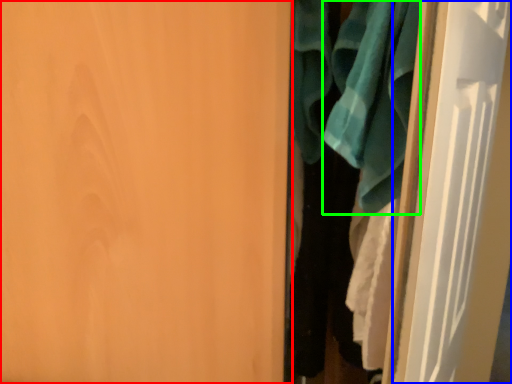
Question: Based on their relative distances, which object is farther from door (highlighted by a red box)? Choose from door (highlighted by a blue box) and bath towel (highlighted by a green box).

Choices:
 (A) door
 (B) bath towel

Answer: (A)